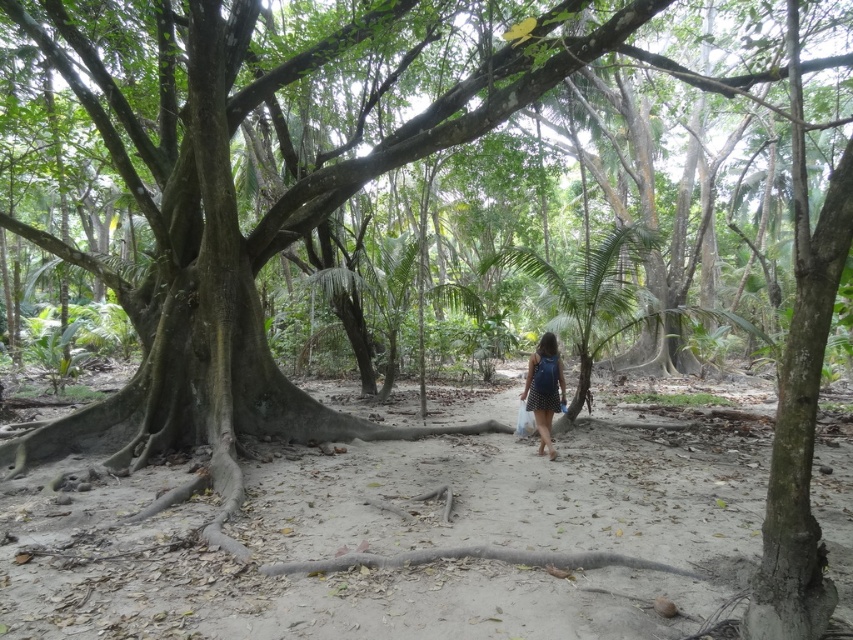
Looking at this image, you are planning to walk through the dirt path at center while wearing the blue denim dress at center. Will the dress fit through the path without getting caught on the sides?

The dirt path at center is wider than the blue denim dress at center, so the dress will fit through the path without any issues.